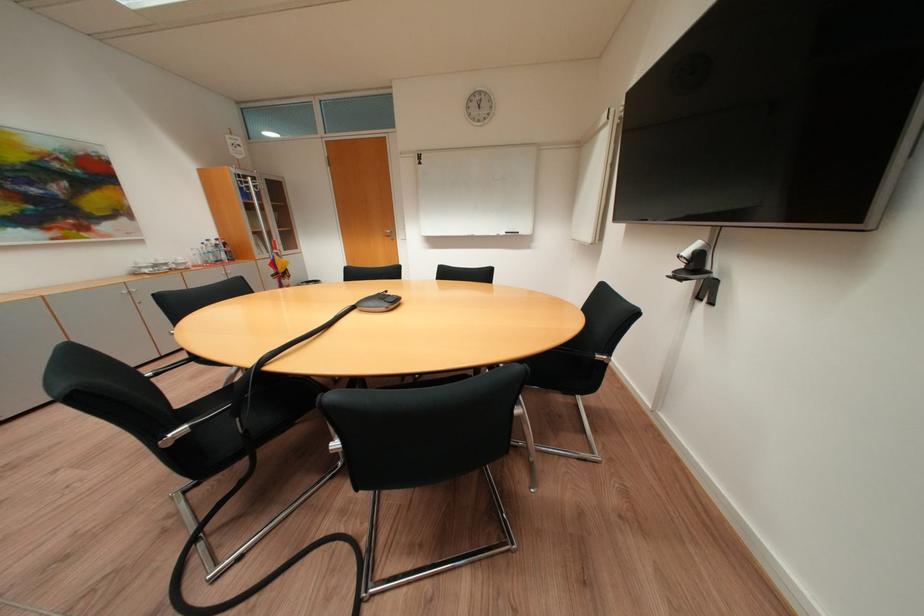
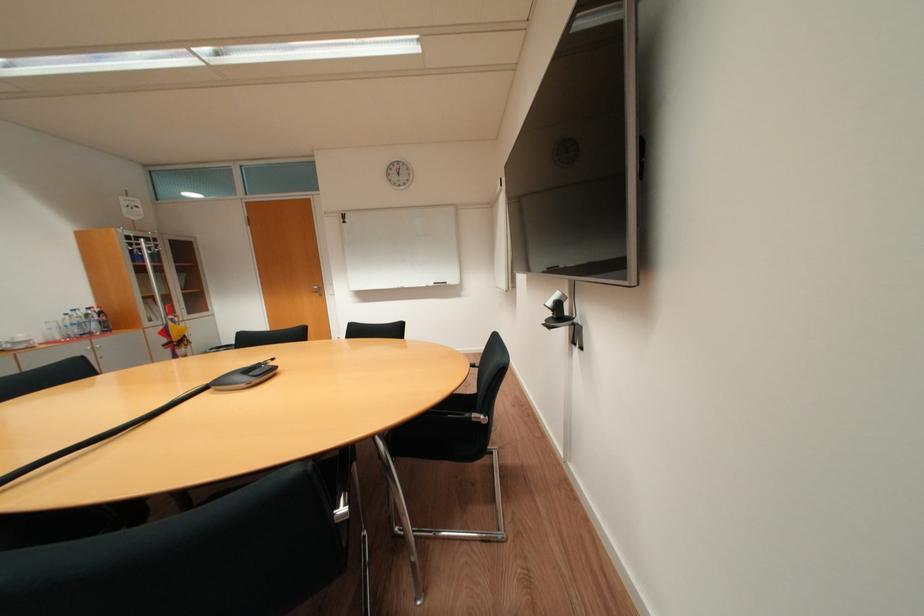
Find the pixel in the second image that matches pixel 204 253 in the first image.

(62, 326)